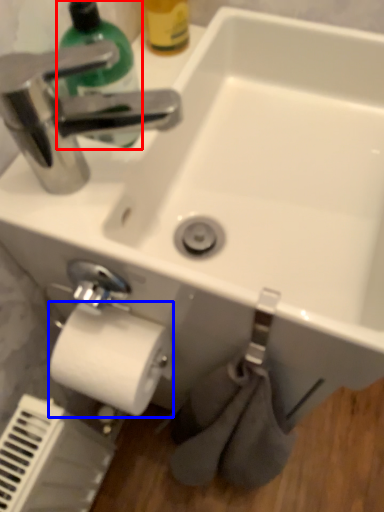
Question: Among these objects, which one is nearest to the camera, cleaning product (highlighted by a red box) or toilet paper (highlighted by a blue box)?

Choices:
 (A) cleaning product
 (B) toilet paper

Answer: (A)